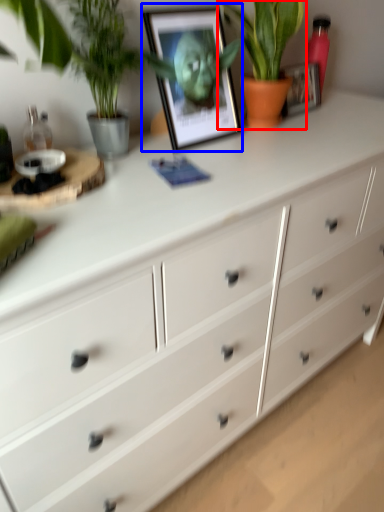
Question: Among these objects, which one is farthest to the camera, houseplant (highlighted by a red box) or picture frame (highlighted by a blue box)?

Choices:
 (A) houseplant
 (B) picture frame

Answer: (A)